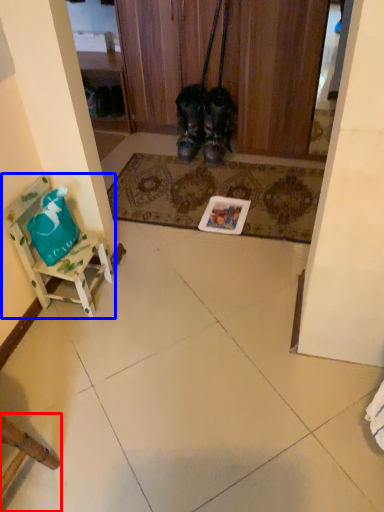
Question: Which object is further to the camera taking this photo, chair (highlighted by a red box) or furniture (highlighted by a blue box)?

Choices:
 (A) chair
 (B) furniture

Answer: (B)